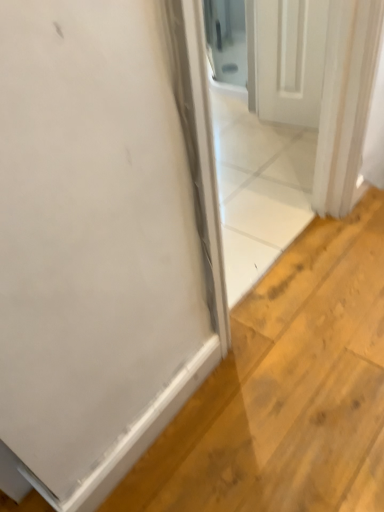
Where is `white matte door at center`? This screenshot has height=512, width=384. white matte door at center is located at coordinates (102, 238).

What do you see at coordinates (102, 238) in the screenshot?
I see `white matte door at center` at bounding box center [102, 238].

Locate an element on the screen. This screenshot has height=512, width=384. white matte door at center is located at coordinates (102, 238).